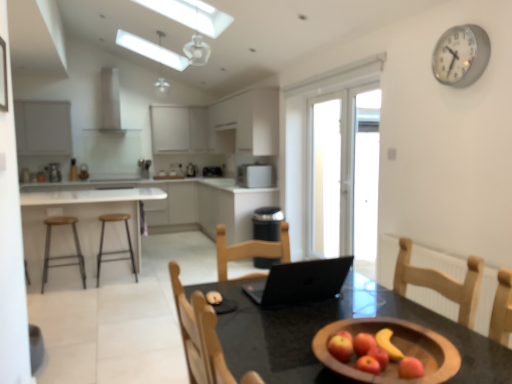
Question: From a real-world perspective, relative to satin silver toaster at center, placed as the 3th appliance when sorted from front to back, is white matte exhaust hood at upper center vertically above or below?

Choices:
 (A) below
 (B) above

Answer: (B)

Question: Is white matte exhaust hood at upper center situated inside satin silver toaster at center, the second appliance from the left, or outside?

Choices:
 (A) outside
 (B) inside

Answer: (A)

Question: Estimate the real-world distances between objects in this image. Which object is closer to the wooden table at left?

Choices:
 (A) white matte cabinetry at left, which is the 4th cabinetry from right to left
 (B) white matte cabinet at upper center, the 4th cabinetry in the left-to-right sequence
 (C) black matte laptop at center
 (D) white matte cabinet at upper center, which appears as the third cabinetry when viewed from the left
 (E) white matte exhaust hood at upper center

Answer: (A)

Question: Which of these objects is positioned closest to the metallic brown stool at left, acting as the 1th stool starting from the left?

Choices:
 (A) transparent glass door at center
 (B) brushed metal kettle at left, marked as the third appliance in a back-to-front arrangement
 (C) satin silver toaster at center, which is the second appliance from back to front
 (D) white metallic clock at upper right
 (E) white matte cabinet at upper center, which appears as the third cabinetry when viewed from the left

Answer: (B)